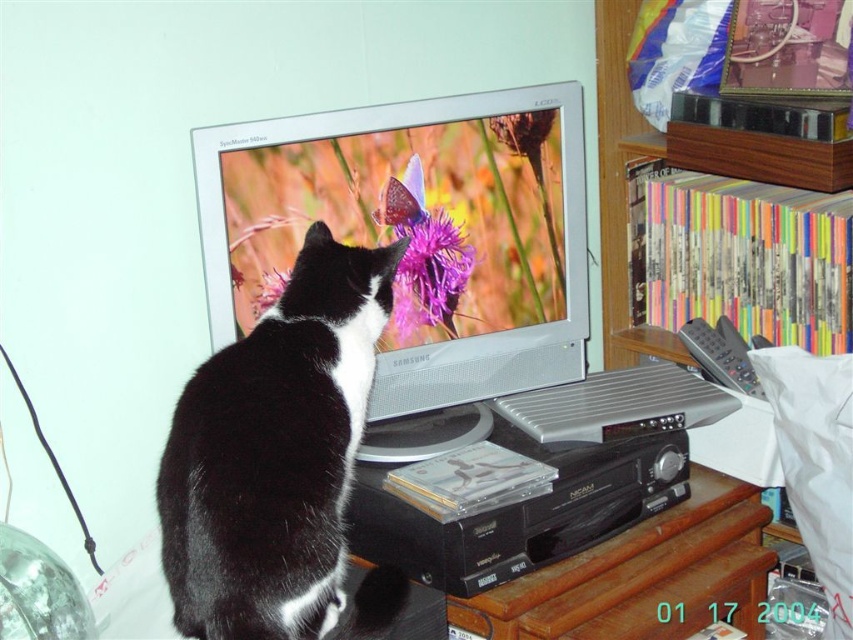
You are a guest in this room and want to grab the gray plastic remote at right without disturbing the black and white fur cat at left. Which direction should you move towards the cat to reach the remote?

Since the black and white fur cat at left is to the left of the gray plastic remote at right, you should move to the right of the cat to reach the gray plastic remote at right without disturbing it.

You are a guest in this room and want to pick up the gray plastic remote at right to change the TV channel. Is the black and white fur cat at left blocking your path to the remote?

The black and white fur cat at left is positioned under the gray plastic remote at right, so the cat is directly below the remote. To reach the remote, you would need to move past or around the cat, which might be blocking your path depending on your approach.

You are taking a photo of the scene and want to focus on both the point at coordinates point (328,628) and the point at coordinates point (746,387). Which point should you focus on first to ensure both are in focus?

You should focus on point (328,628) first because it is closer to the camera than point (746,387), so focusing on the closer point will help ensure both are in focus.